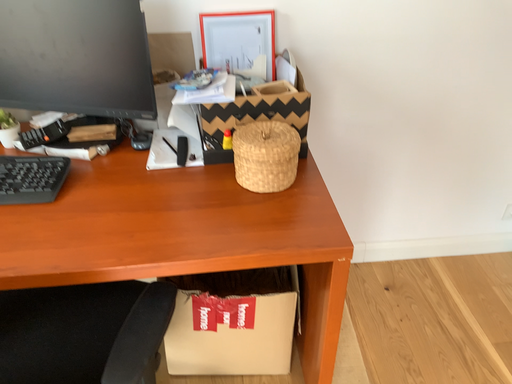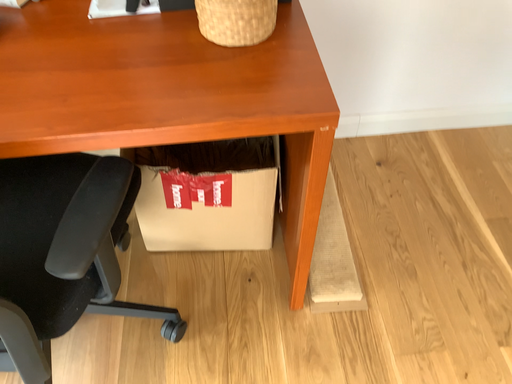
Question: How did the camera likely rotate when shooting the video?

Choices:
 (A) rotated upward
 (B) rotated downward

Answer: (B)